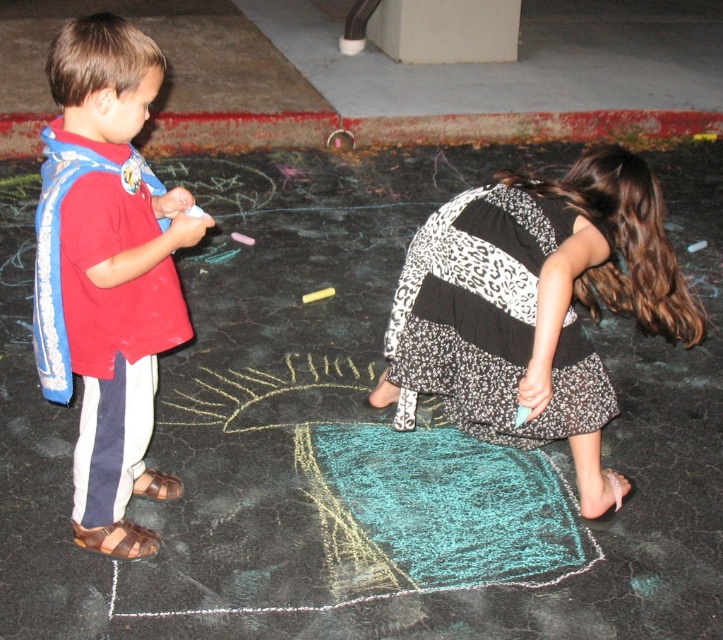
Question: Is matte red shirt at left thinner than yellow chalk at center?

Choices:
 (A) no
 (B) yes

Answer: (A)

Question: Among these points, which one is nearest to the camera?

Choices:
 (A) pyautogui.click(x=114, y=237)
 (B) pyautogui.click(x=322, y=289)
 (C) pyautogui.click(x=599, y=440)

Answer: (A)

Question: Does printed fabric dress at lower right have a greater width compared to yellow chalk at center?

Choices:
 (A) no
 (B) yes

Answer: (B)

Question: Is printed fabric dress at lower right positioned at the back of yellow chalk at center?

Choices:
 (A) yes
 (B) no

Answer: (B)

Question: Among these objects, which one is farthest from the camera?

Choices:
 (A) matte red shirt at left
 (B) printed fabric dress at lower right

Answer: (B)

Question: Considering the real-world distances, which object is farthest from the yellow chalk at center?

Choices:
 (A) matte red shirt at left
 (B) printed fabric dress at lower right

Answer: (A)